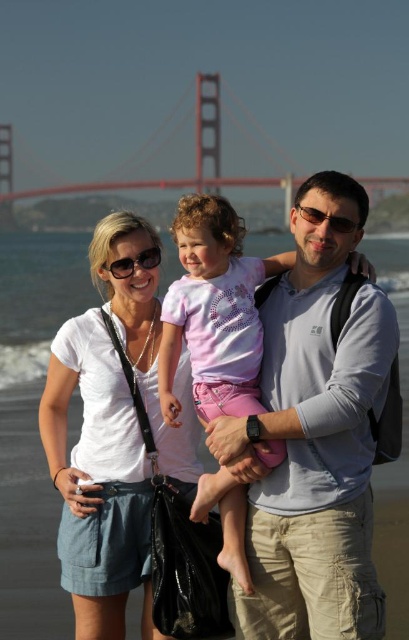
Question: Can you confirm if gray cotton shirt at center is positioned to the right of white cotton shirt at center?

Choices:
 (A) no
 (B) yes

Answer: (B)

Question: Based on their relative distances, which object is farther from the white cotton shirt at center?

Choices:
 (A) gray cotton shirt at center
 (B) red painted steel bridge at upper center

Answer: (B)

Question: Can you confirm if gray cotton shirt at center is bigger than red painted steel bridge at upper center?

Choices:
 (A) no
 (B) yes

Answer: (A)

Question: Estimate the real-world distances between objects in this image. Which object is closer to the red painted steel bridge at upper center?

Choices:
 (A) gray cotton shirt at center
 (B) white cotton shirt at center

Answer: (A)

Question: Which point appears farthest from the camera in this image?

Choices:
 (A) (107, 188)
 (B) (233, 598)

Answer: (A)

Question: Is the position of gray cotton shirt at center less distant than that of white cotton shirt at center?

Choices:
 (A) no
 (B) yes

Answer: (B)